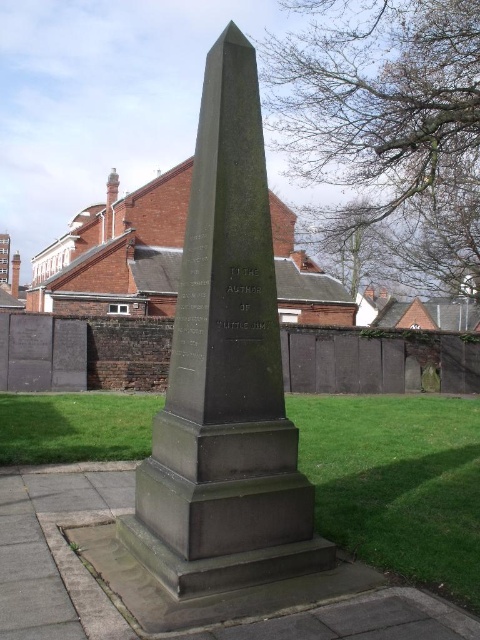
Where is `dark gray stone obelisk at center`? dark gray stone obelisk at center is located at coordinates (226, 374).

Is dark gray stone obelisk at center to the left of green grass at center from the viewer's perspective?

Yes, dark gray stone obelisk at center is to the left of green grass at center.

The width and height of the screenshot is (480, 640). Find the location of `dark gray stone obelisk at center`. dark gray stone obelisk at center is located at coordinates (226, 374).